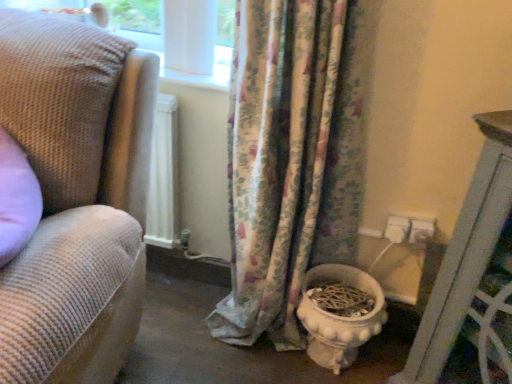
Question: Is woven fabric couch at left positioned in front of white glossy toilet bowl at lower center?

Choices:
 (A) yes
 (B) no

Answer: (A)

Question: Is woven fabric couch at left far from white glossy toilet bowl at lower center?

Choices:
 (A) yes
 (B) no

Answer: (B)

Question: Is woven fabric couch at left smaller than white glossy toilet bowl at lower center?

Choices:
 (A) yes
 (B) no

Answer: (B)

Question: Would you say woven fabric couch at left is outside white glossy toilet bowl at lower center?

Choices:
 (A) no
 (B) yes

Answer: (B)

Question: From a real-world perspective, is woven fabric couch at left below white glossy toilet bowl at lower center?

Choices:
 (A) no
 (B) yes

Answer: (A)

Question: From the image's perspective, would you say woven fabric couch at left is shown under white glossy toilet bowl at lower center?

Choices:
 (A) no
 (B) yes

Answer: (A)

Question: Can you confirm if white glossy toilet bowl at lower center is wider than floral fabric curtain at center?

Choices:
 (A) yes
 (B) no

Answer: (A)

Question: Is white glossy toilet bowl at lower center to the right of floral fabric curtain at center from the viewer's perspective?

Choices:
 (A) no
 (B) yes

Answer: (B)

Question: From a real-world perspective, is white glossy toilet bowl at lower center located beneath floral fabric curtain at center?

Choices:
 (A) no
 (B) yes

Answer: (B)

Question: Is floral fabric curtain at center surrounded by white glossy toilet bowl at lower center?

Choices:
 (A) no
 (B) yes

Answer: (A)

Question: Does white glossy toilet bowl at lower center lie behind floral fabric curtain at center?

Choices:
 (A) no
 (B) yes

Answer: (B)

Question: Is floral fabric curtain at center at the back of white glossy toilet bowl at lower center?

Choices:
 (A) no
 (B) yes

Answer: (B)

Question: Is there a large distance between floral fabric curtain at center and woven fabric couch at left?

Choices:
 (A) yes
 (B) no

Answer: (B)